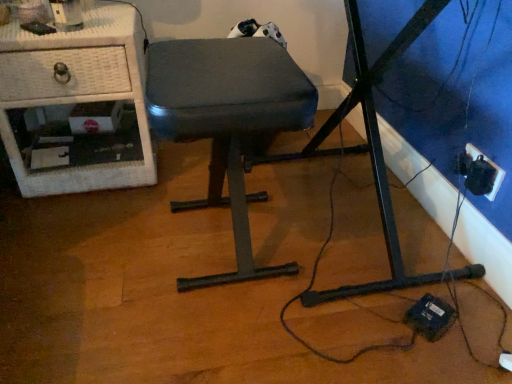
The height and width of the screenshot is (384, 512). In order to click on blank area to the left of dark gray fabric stool at center in this screenshot , I will do `click(89, 253)`.